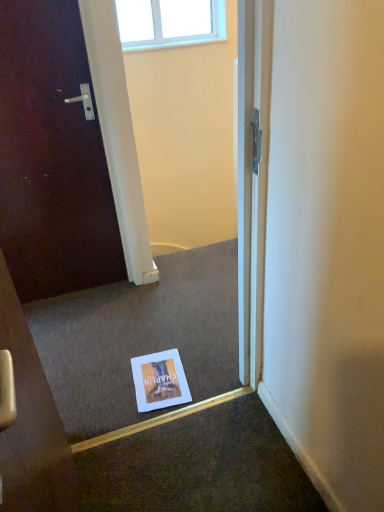
Where is `free spot to the right of white paper flyer at center`? The height and width of the screenshot is (512, 384). free spot to the right of white paper flyer at center is located at coordinates (205, 376).